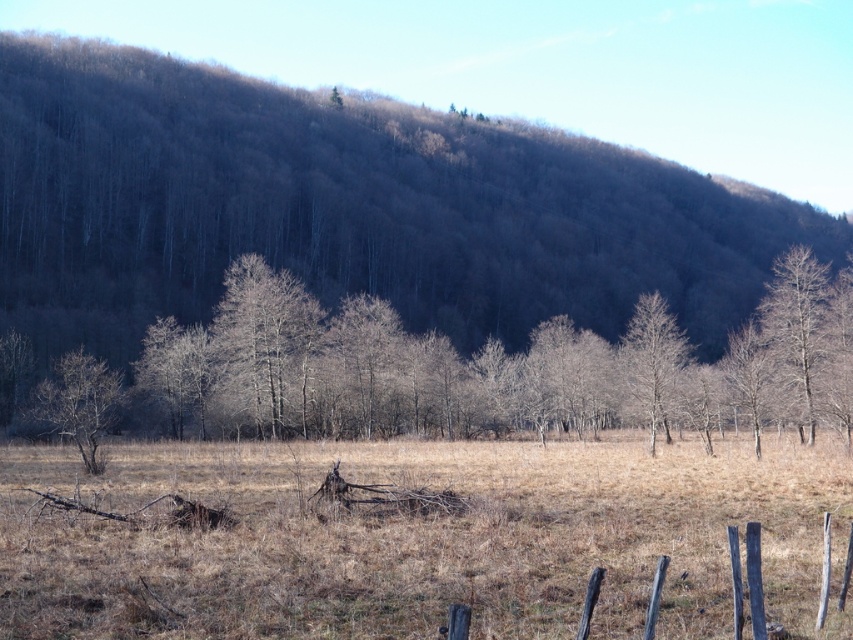
Question: Which of these objects is positioned farthest from the bare branches at center?

Choices:
 (A) bare wood tree at center
 (B) weathered wood fence at lower right

Answer: (B)

Question: Which point is closer to the camera?

Choices:
 (A) coord(851,548)
 (B) coord(112,381)

Answer: (A)

Question: Can you confirm if brown dry grass at center is positioned to the left of bare wood tree at left?

Choices:
 (A) no
 (B) yes

Answer: (A)

Question: Is brown dry grass at center further to the viewer compared to bare wood tree at left?

Choices:
 (A) no
 (B) yes

Answer: (A)

Question: Which is farther from the bare wood tree at left?

Choices:
 (A) bare wood tree at right
 (B) bare wood tree at center
 (C) brown/dry grass at upper center

Answer: (C)

Question: Does brown dry grass at center lie in front of weathered wood fence at lower right?

Choices:
 (A) yes
 (B) no

Answer: (B)